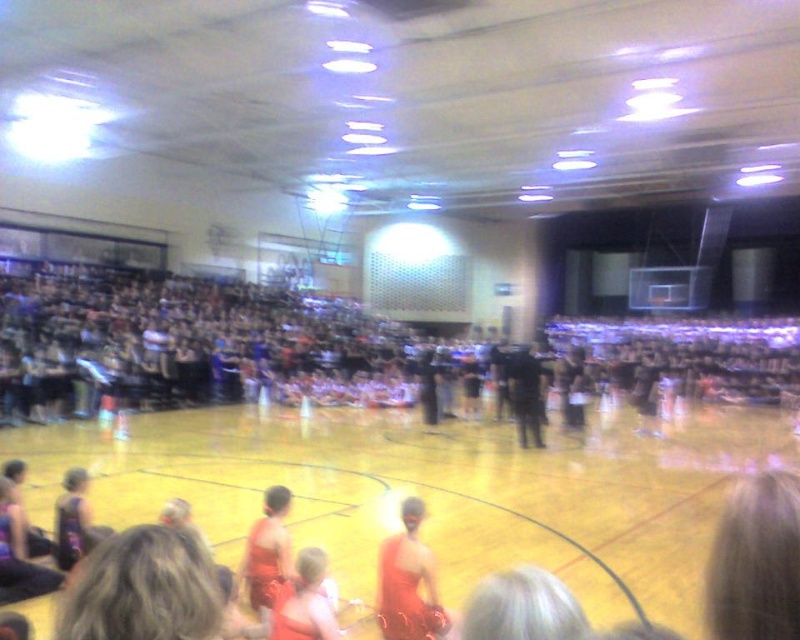
You are a photographer trying to capture a clear shot of the matte red shorts at center without the dark gray fabric crowd at upper left blocking the view. Based on their heights, can you position yourself in a way to avoid the crowd blocking the shorts?

The dark gray fabric crowd at upper left is taller than the matte red shorts at center. To avoid the crowd blocking the view, you should position yourself lower or angle your camera downward to focus on the matte red shorts at center, which is shorter than the crowd.

You are standing in the gymnasium and want to reach the point marked at coordinates point (397, 563). Considering the distance between you and the point is 4.20 meters, and there are several obstacles like the seated individuals in red costumes and the bleachers, can you walk straight to the point without any hindrance?

The point (397, 563) is 4.20 meters away from you. However, there are obstacles like the seated individuals in red costumes and the bleachers in the way, so you cannot walk straight to the point without hindrance.

You are a photographer trying to capture a clear shot of the matte red shorts at center during the dance performance. However, the dark gray fabric crowd at upper left is obstructing your view. Can you estimate if the crowd is wider than the shorts?

The dark gray fabric crowd at upper left might be wider than matte red shorts at center, so there is a possibility that the crowd is obstructing the view of the shorts.